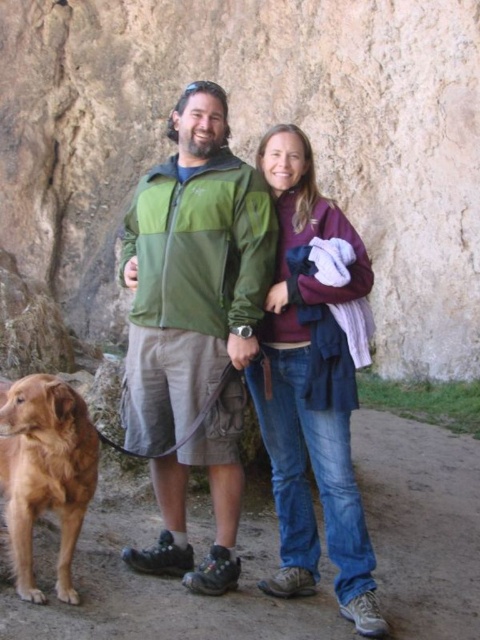
You are standing at point (181, 289) and want to walk to point (345, 593). Which direction should you move in to reach your destination?

To reach point (345, 593) from point (181, 289), you should move towards the upper right direction since point (181, 289) is behind point (345, 593).

You are a photographer standing in front of the scene. You want to take a photo of the green fabric jacket at center and the golden fur dog at lower left. Which object is closer to you, making it appear larger in the photo?

The green fabric jacket at center is closer to you than the golden fur dog at lower left, so it will appear larger in the photo.